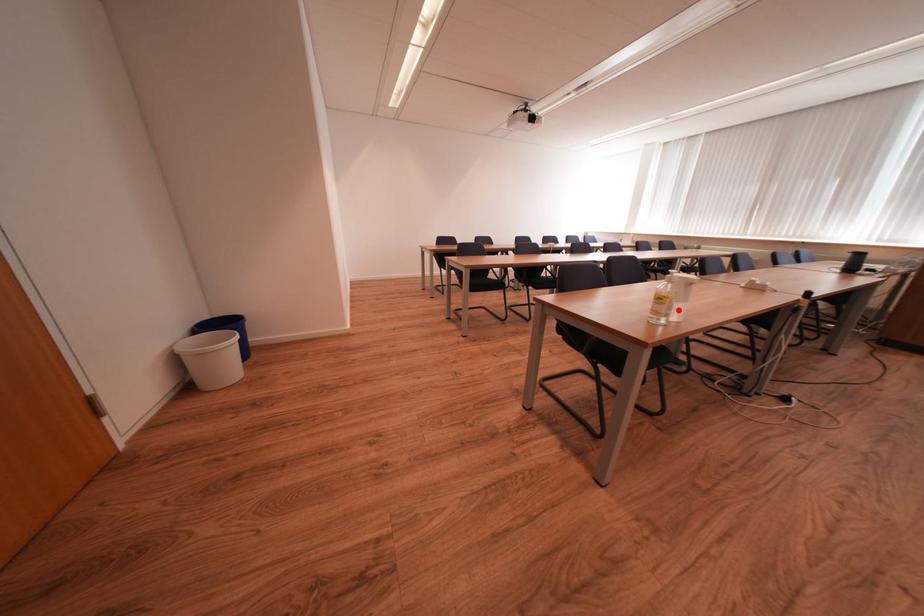
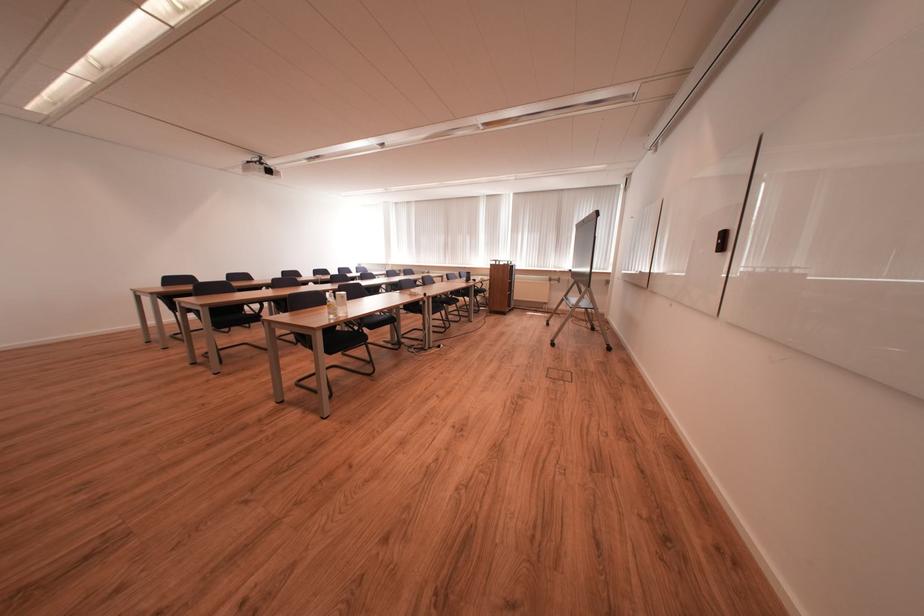
In the second image, find the point that corresponds to the highlighted location in the first image.

(344, 310)